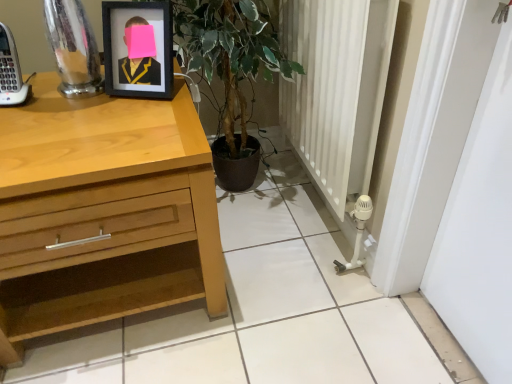
What is the approximate height of light wood chest of drawers at left?

light wood chest of drawers at left is 57.10 centimeters in height.

The image size is (512, 384). In order to click on light wood chest of drawers at left in this screenshot , I will do `click(103, 212)`.

What do you see at coordinates (103, 212) in the screenshot?
I see `light wood chest of drawers at left` at bounding box center [103, 212].

What is the approximate width of light wood chest of drawers at left?

light wood chest of drawers at left is 25.05 inches wide.

Describe the element at coordinates (140, 55) in the screenshot. The image size is (512, 384). I see `black matte picture frame at upper left` at that location.

I want to click on black matte picture frame at upper left, so click(x=140, y=55).

What is the approximate width of black matte picture frame at upper left?

black matte picture frame at upper left is 4.85 inches wide.

The image size is (512, 384). Identify the location of light wood chest of drawers at left. (103, 212).

Which is more to the right, light wood chest of drawers at left or black matte picture frame at upper left?

From the viewer's perspective, black matte picture frame at upper left appears more on the right side.

Considering their positions, is light wood chest of drawers at left located in front of or behind black matte picture frame at upper left?

In the image, light wood chest of drawers at left appears in front of black matte picture frame at upper left.

Is point (55, 88) farther from camera compared to point (170, 58)?

Yes, it is behind point (170, 58).

From the image's perspective, is light wood chest of drawers at left under black matte picture frame at upper left?

Yes, from the image's perspective, light wood chest of drawers at left is beneath black matte picture frame at upper left.

Based on the photo, from a real-world perspective, which is physically below, light wood chest of drawers at left or black matte picture frame at upper left?

light wood chest of drawers at left, from a real-world perspective.

Considering the relative sizes of light wood chest of drawers at left and black matte picture frame at upper left in the image provided, is light wood chest of drawers at left wider than black matte picture frame at upper left?

Indeed, light wood chest of drawers at left has a greater width compared to black matte picture frame at upper left.

Considering the relative sizes of light wood chest of drawers at left and black matte picture frame at upper left in the image provided, is light wood chest of drawers at left shorter than black matte picture frame at upper left?

In fact, light wood chest of drawers at left may be taller than black matte picture frame at upper left.

Which of these two, light wood chest of drawers at left or black matte picture frame at upper left, is bigger?

Bigger between the two is light wood chest of drawers at left.

Is light wood chest of drawers at left located outside black matte picture frame at upper left?

Yes, light wood chest of drawers at left is not within black matte picture frame at upper left.

Would you consider light wood chest of drawers at left to be distant from black matte picture frame at upper left?

light wood chest of drawers at left is near black matte picture frame at upper left, not far away.

Is light wood chest of drawers at left positioned with its back to black matte picture frame at upper left?

No, black matte picture frame at upper left is not at the back of light wood chest of drawers at left.

Where is `picture frame above the light wood chest of drawers at left (from a real-world perspective)`? picture frame above the light wood chest of drawers at left (from a real-world perspective) is located at coordinates (140, 55).

Which object is positioned more to the right, black matte picture frame at upper left or light wood chest of drawers at left?

black matte picture frame at upper left is more to the right.

Considering the positions of objects black matte picture frame at upper left and light wood chest of drawers at left in the image provided, who is behind, black matte picture frame at upper left or light wood chest of drawers at left?

black matte picture frame at upper left is behind.

Which point is more distant from viewer, (124, 26) or (42, 257)?

Point (124, 26)

From the image's perspective, is black matte picture frame at upper left positioned above or below light wood chest of drawers at left?

black matte picture frame at upper left is above light wood chest of drawers at left.

Based on the photo, from a real-world perspective, is black matte picture frame at upper left positioned above or below light wood chest of drawers at left?

black matte picture frame at upper left is above light wood chest of drawers at left.

Considering the relative sizes of black matte picture frame at upper left and light wood chest of drawers at left in the image provided, is black matte picture frame at upper left wider than light wood chest of drawers at left?

In fact, black matte picture frame at upper left might be narrower than light wood chest of drawers at left.

Considering the relative sizes of black matte picture frame at upper left and light wood chest of drawers at left in the image provided, is black matte picture frame at upper left shorter than light wood chest of drawers at left?

Correct, black matte picture frame at upper left is not as tall as light wood chest of drawers at left.

Between black matte picture frame at upper left and light wood chest of drawers at left, which one has smaller size?

black matte picture frame at upper left is smaller.

Is light wood chest of drawers at left located within black matte picture frame at upper left?

That's incorrect, light wood chest of drawers at left is not inside black matte picture frame at upper left.

Would you say black matte picture frame at upper left is a long distance from light wood chest of drawers at left?

No, black matte picture frame at upper left is in close proximity to light wood chest of drawers at left.

Is black matte picture frame at upper left turned away from light wood chest of drawers at left?

No, light wood chest of drawers at left is not at the back of black matte picture frame at upper left.

How distant is black matte picture frame at upper left from light wood chest of drawers at left?

A distance of 11.94 inches exists between black matte picture frame at upper left and light wood chest of drawers at left.

Image resolution: width=512 pixels, height=384 pixels. In order to click on picture frame above the light wood chest of drawers at left (from the image's perspective) in this screenshot , I will do `click(140, 55)`.

In the image, there is a black matte picture frame at upper left. Where is `the chest of drawers below it (from a real-world perspective)`? The width and height of the screenshot is (512, 384). the chest of drawers below it (from a real-world perspective) is located at coordinates (103, 212).

You are a GUI agent. You are given a task and a screenshot of the screen. Output one action in this format:
    pyautogui.click(x=<x>, y=<y>)
    Task: Click on the chest of drawers that appears below the black matte picture frame at upper left (from the image's perspective)
    This screenshot has height=384, width=512.
    Given the screenshot: What is the action you would take?
    pyautogui.click(x=103, y=212)